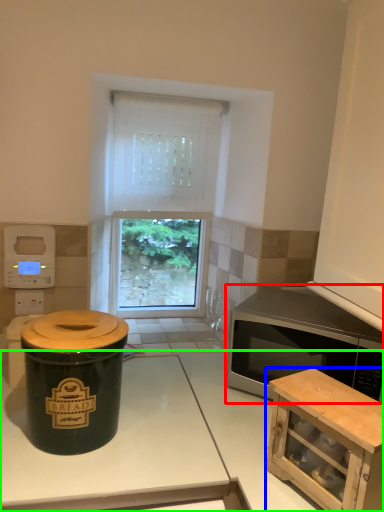
Question: Considering the real-world distances, which object is farthest from microwave oven (highlighted by a red box)? cabinetry (highlighted by a blue box) or countertop (highlighted by a green box)?

Choices:
 (A) cabinetry
 (B) countertop

Answer: (B)